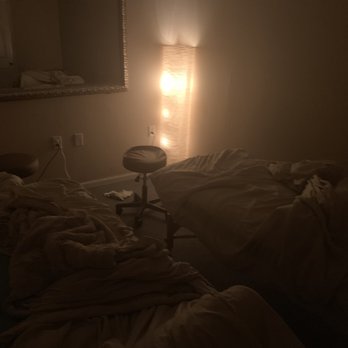
Find the location of `clutter`. clutter is located at coordinates (77, 243).